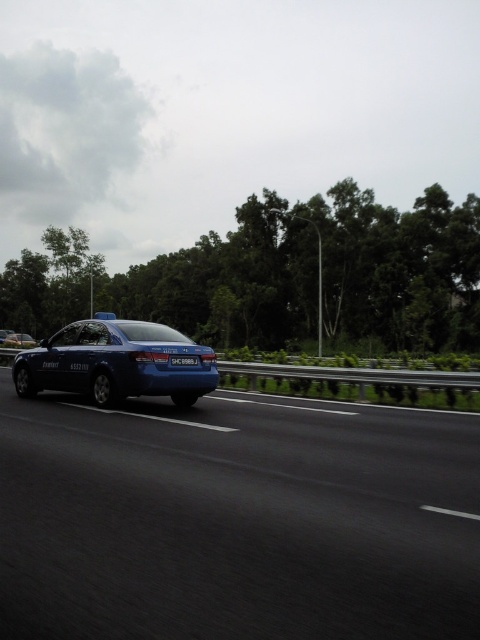
Based on the photo, you are a driver approaching the highway and see a blue glossy car at center and a matte blue sedan at left. Which car should you follow if you want to stay in the correct lane?

You should follow the blue glossy car at center because it is in front of the matte blue sedan at left, indicating it is in the same lane.

You are a pedestrian standing on the sidewalk and see both the blue glossy car at center and the matte blue sedan at left. Which one is closer to the right side of the road?

The blue glossy car at center is positioned on the right side of the matte blue sedan at left, so it is closer to the right side of the road.